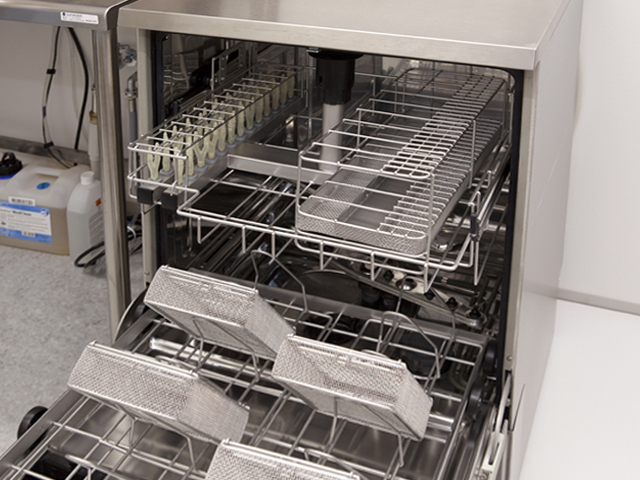
The height and width of the screenshot is (480, 640). I want to click on tray, so click(273, 189), click(264, 428).